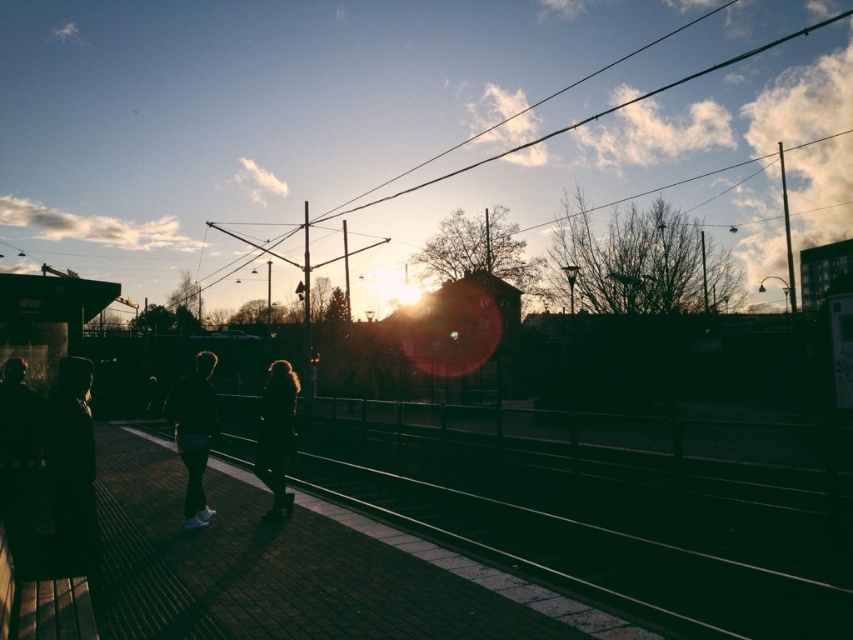
You are standing on the platform at the train station and see the black matte jacket at center. Can you estimate its exact location using the coordinate system where the bottom left corner is the origin?

The black matte jacket at center is located at coordinate point 0.677 on the x axis and 0.227 on the y axis.

You are a photographer trying to capture the sunset at the train station. You notice two figures on the platform, the dark clothing at left and the black matte jacket at center. Which figure is positioned higher relative to the other?

The dark clothing at left is positioned higher than the black matte jacket at center because it is located above it.

You are a photographer trying to capture a photo of the dark clothing at left and the black matte jacket at center in the same frame. If your camera has a focal length of 50mm, which has a field of view that can cover 6 meters, can you include both objects in your shot?

The dark clothing at left is 2.42 meters from the black matte jacket at center. Since the distance between them is less than the 6 meters field of view of the camera, both objects can be captured in the same frame.